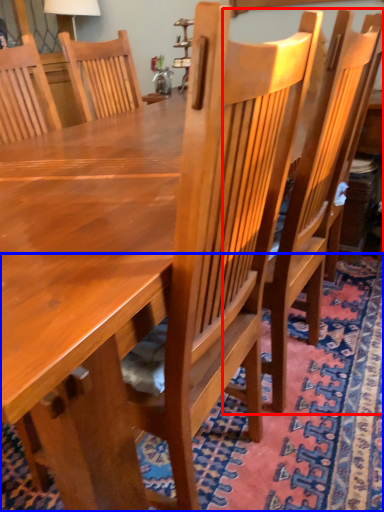
Question: Which object appears closest to the camera in this image, chair (highlighted by a red box) or mat (highlighted by a blue box)?

Choices:
 (A) chair
 (B) mat

Answer: (B)